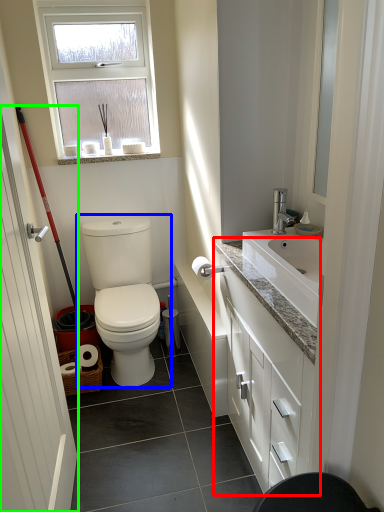
Question: Estimate the real-world distances between objects in this image. Which object is closer to bathroom cabinet (highlighted by a red box), toilet (highlighted by a blue box) or door (highlighted by a green box)?

Choices:
 (A) toilet
 (B) door

Answer: (A)